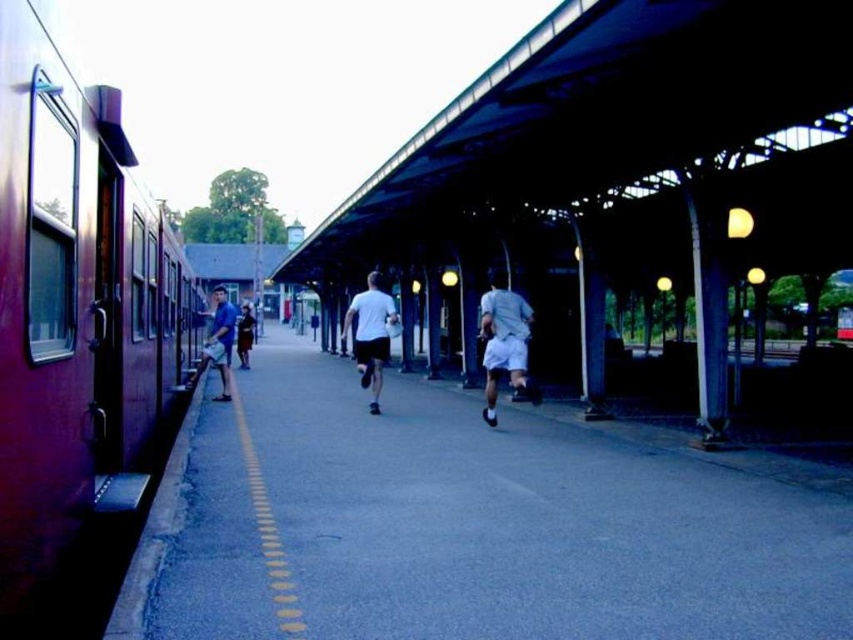
Question: Which of these objects is positioned closest to the metallic red train at left?

Choices:
 (A) white cotton shorts at center
 (B) white matte shirt at center
 (C) blue cotton shirt at left
 (D) dark blue jeans at center

Answer: (C)

Question: Which point is closer to the camera?

Choices:
 (A) (370, 323)
 (B) (488, 330)

Answer: (B)

Question: Is white cotton shorts at center to the right of blue cotton shirt at left from the viewer's perspective?

Choices:
 (A) yes
 (B) no

Answer: (A)

Question: Which point appears closest to the camera in this image?

Choices:
 (A) (242, 339)
 (B) (152, 330)
 (C) (495, 392)

Answer: (B)

Question: Does metallic red train at left have a lesser width compared to blue cotton shirt at left?

Choices:
 (A) no
 (B) yes

Answer: (B)

Question: Can you confirm if metallic red train at left is positioned to the left of dark blue jeans at center?

Choices:
 (A) no
 (B) yes

Answer: (A)